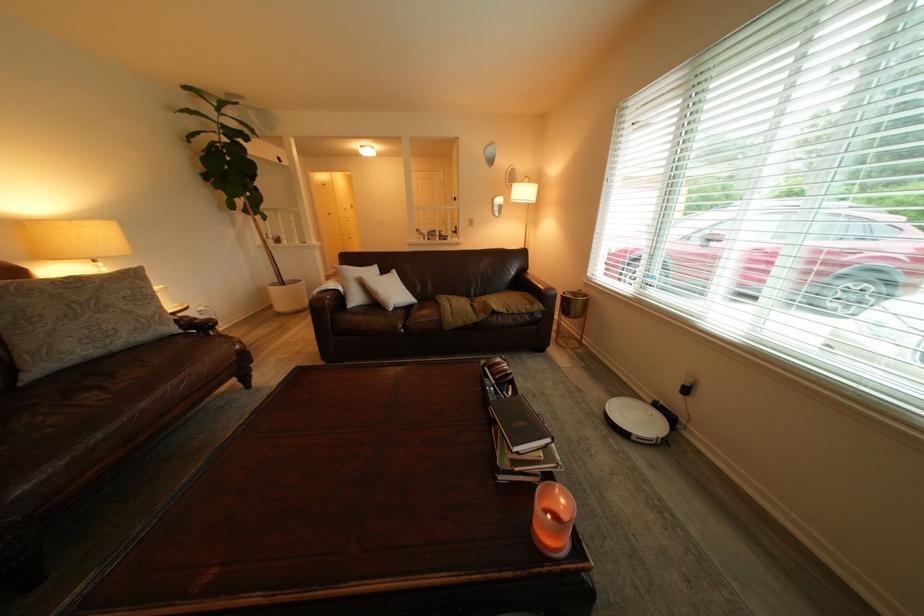
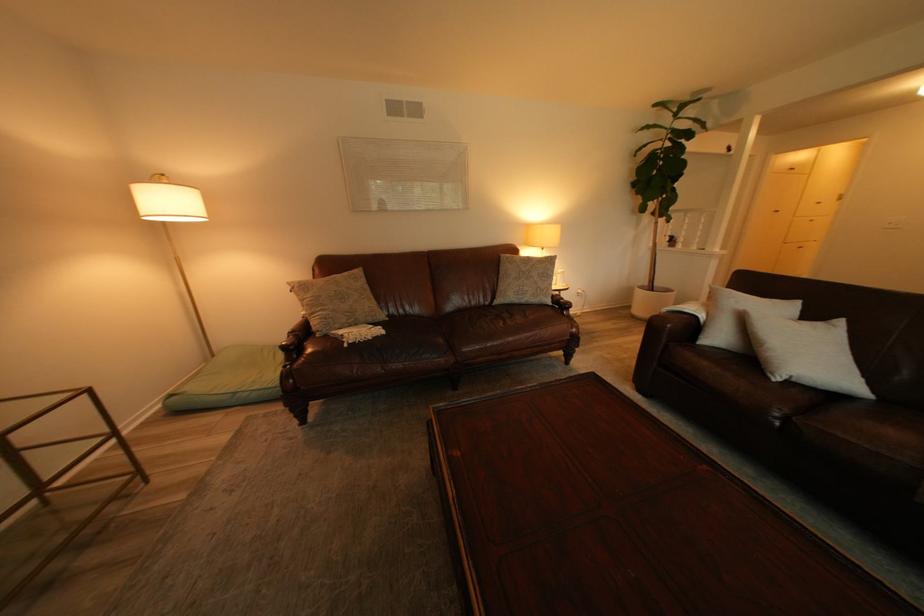
Find the pixel in the second image that matches point (101, 342) in the first image.

(529, 294)